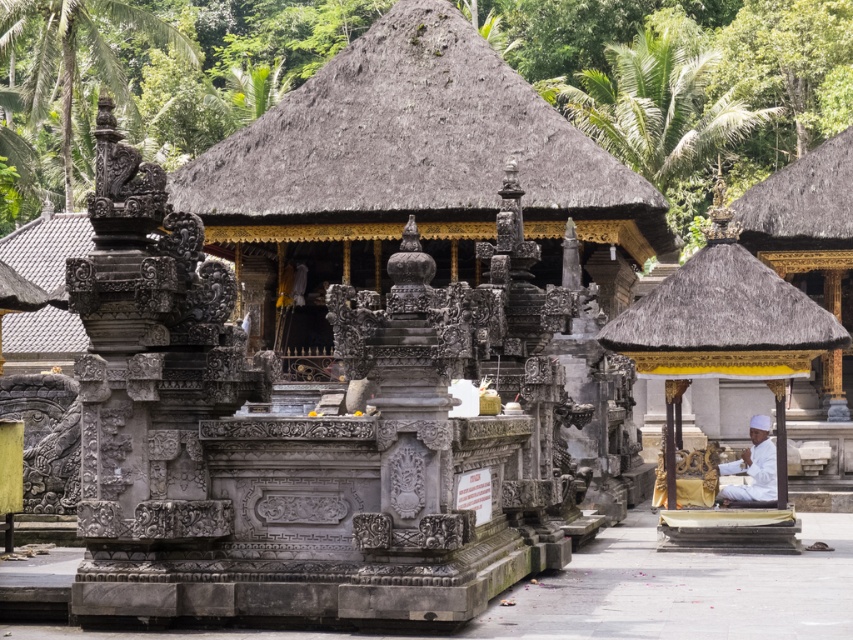
Who is higher up, thatched roof at center or brown thatch roof at upper right?

thatched roof at center is higher up.

Does thatched roof at center appear on the right side of brown thatch roof at upper right?

Incorrect, thatched roof at center is not on the right side of brown thatch roof at upper right.

Find the location of a particular element. The height and width of the screenshot is (640, 853). thatched roof at center is located at coordinates (407, 134).

This screenshot has height=640, width=853. Find the location of `thatched roof at center`. thatched roof at center is located at coordinates (407, 134).

Is thatched roof at center below thatched roof gazebo at right?

Incorrect, thatched roof at center is not positioned below thatched roof gazebo at right.

Who is taller, thatched roof at center or thatched roof gazebo at right?

thatched roof at center

Locate an element on the screen. thatched roof at center is located at coordinates (407, 134).

Who is positioned more to the right, thatched roof gazebo at right or brown thatch roof at upper right?

From the viewer's perspective, brown thatch roof at upper right appears more on the right side.

Is thatched roof gazebo at right above brown thatch roof at upper right?

Incorrect, thatched roof gazebo at right is not positioned above brown thatch roof at upper right.

Is point (711, 214) in front of point (821, 186)?

Yes, point (711, 214) is closer to viewer.

At what (x,y) coordinates should I click in order to perform the action: click on thatched roof gazebo at right. Please return your answer as a coordinate pair (x, y). This screenshot has height=640, width=853. Looking at the image, I should click on (723, 332).